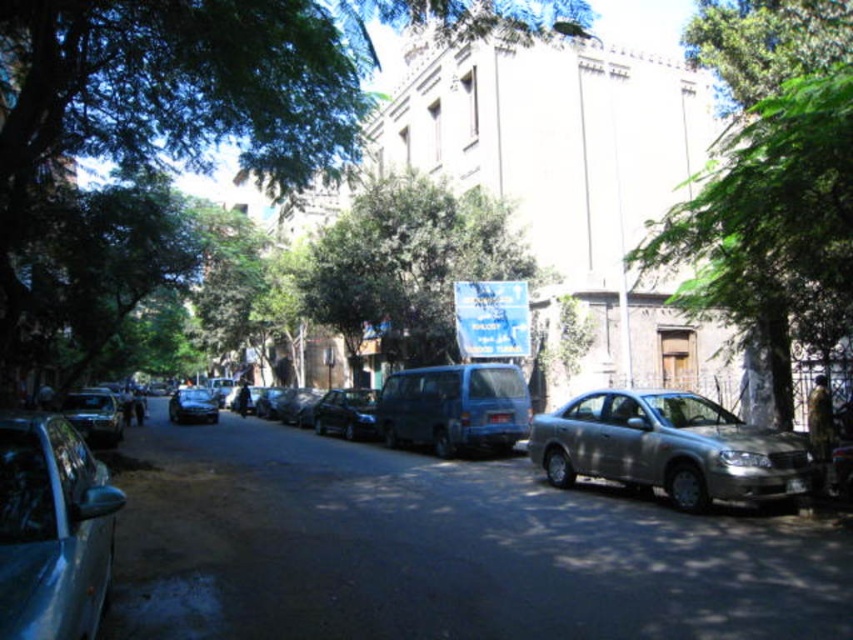
Does green leafy tree at center appear under shiny black car at center?

No, green leafy tree at center is not below shiny black car at center.

Can you confirm if green leafy tree at center is positioned to the left of shiny black car at center?

Incorrect, green leafy tree at center is not on the left side of shiny black car at center.

The height and width of the screenshot is (640, 853). What do you see at coordinates (405, 268) in the screenshot?
I see `green leafy tree at center` at bounding box center [405, 268].

Where is `green leafy tree at center`? The width and height of the screenshot is (853, 640). green leafy tree at center is located at coordinates (405, 268).

Can you confirm if silver metallic sedan at right is shorter than blue matte van at center?

Yes, silver metallic sedan at right is shorter than blue matte van at center.

Between silver metallic sedan at right and blue matte van at center, which one is positioned higher?

silver metallic sedan at right

Is point (700, 506) in front of point (469, 408)?

That is True.

Identify the location of silver metallic sedan at right. The height and width of the screenshot is (640, 853). (669, 449).

Does silver metallic sedan at right have a smaller size compared to shiny silver sedan at center?

No.

Looking at this image, between silver metallic sedan at right and shiny silver sedan at center, which one appears on the left side from the viewer's perspective?

shiny silver sedan at center is more to the left.

Does point (807, 461) lie in front of point (84, 400)?

Yes, it is in front of point (84, 400).

Where is `silver metallic sedan at right`? Image resolution: width=853 pixels, height=640 pixels. silver metallic sedan at right is located at coordinates (669, 449).